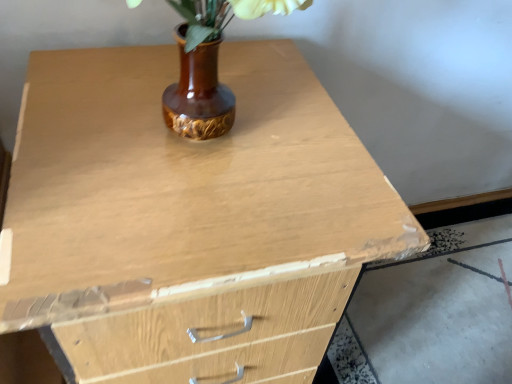
At what (x,y) coordinates should I click in order to perform the action: click on free region under browny-golden ceramic vase at center (from a real-world perspective). Please return your answer as a coordinate pair (x, y). Image resolution: width=512 pixels, height=384 pixels. Looking at the image, I should click on (229, 134).